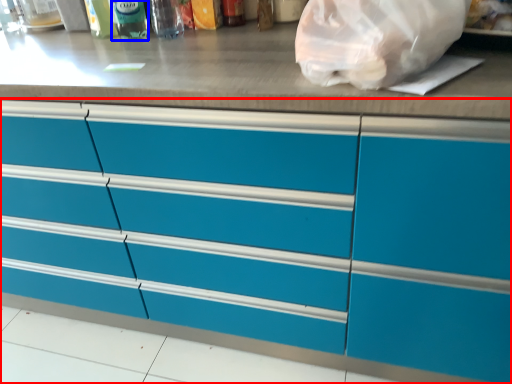
Question: Which object appears closest to the camera in this image, cabinetry (highlighted by a red box) or bottle (highlighted by a blue box)?

Choices:
 (A) cabinetry
 (B) bottle

Answer: (A)